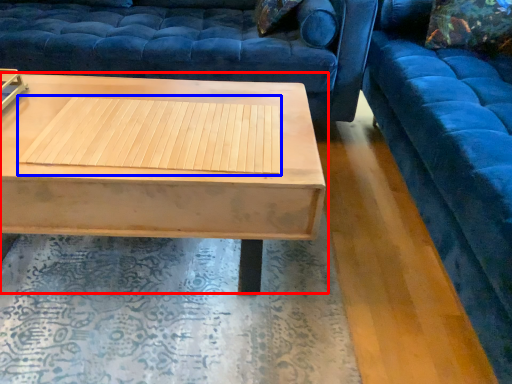
Question: Which point is closer to the camera, coffee table (highlighted by a red box) or wood (highlighted by a blue box)?

Choices:
 (A) coffee table
 (B) wood

Answer: (A)